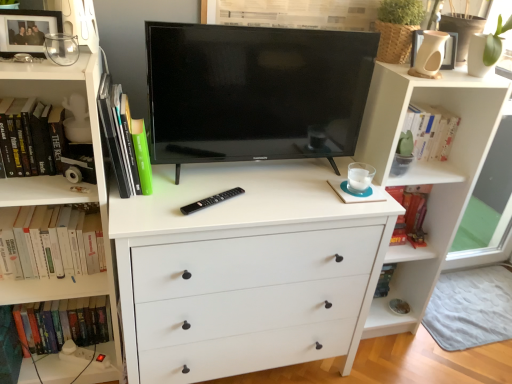
You are a GUI agent. You are given a task and a screenshot of the screen. Output one action in this format:
    pyautogui.click(x=<x>, y=<y>)
    Task: Click on the free location to the right of green matte book at left, the 3th book positioned from the bottom
    The image size is (512, 384).
    Given the screenshot: What is the action you would take?
    pyautogui.click(x=183, y=190)